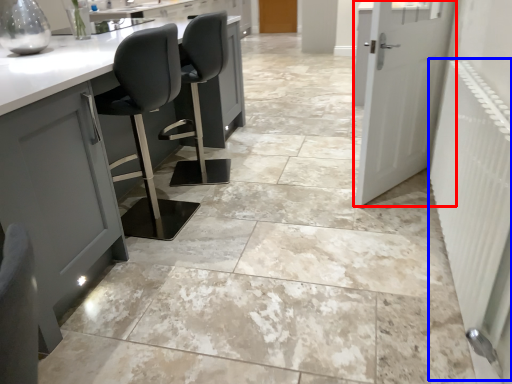
Question: Among these objects, which one is nearest to the camera, door (highlighted by a red box) or radiator (highlighted by a blue box)?

Choices:
 (A) door
 (B) radiator

Answer: (B)